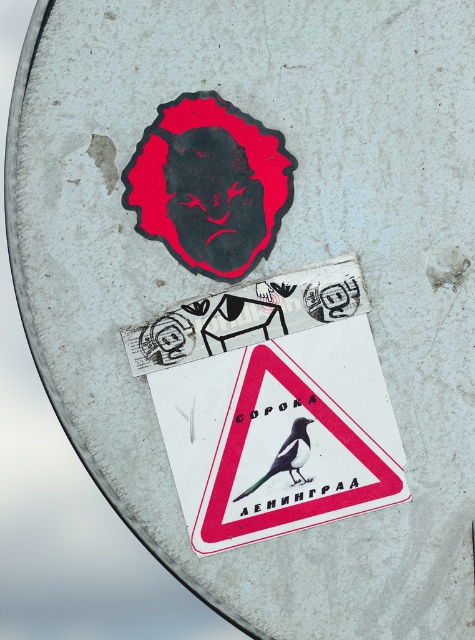
Question: Is the position of white paper triangle at center more distant than that of green glossy bird at center?

Choices:
 (A) yes
 (B) no

Answer: (B)

Question: From the image, what is the correct spatial relationship of white paper triangle at center in relation to green glossy bird at center?

Choices:
 (A) right
 (B) left

Answer: (B)

Question: Is white paper triangle at center positioned behind green glossy bird at center?

Choices:
 (A) no
 (B) yes

Answer: (A)

Question: Which point is closer to the camera?

Choices:
 (A) (298, 480)
 (B) (191, 412)

Answer: (B)

Question: Which point is farther to the camera?

Choices:
 (A) (342, 369)
 (B) (298, 464)

Answer: (B)

Question: Among these objects, which one is farthest from the camera?

Choices:
 (A) white paper triangle at center
 (B) green glossy bird at center

Answer: (B)